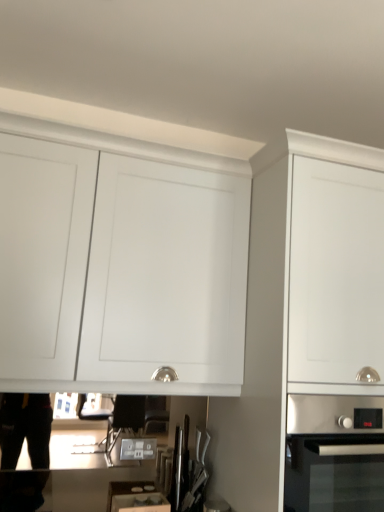
What do you see at coordinates (186, 471) in the screenshot? I see `stainless steel knife block at center` at bounding box center [186, 471].

Where is `stainless steel knife block at center`? stainless steel knife block at center is located at coordinates (186, 471).

From a real-world perspective, is white matte cabinet at center, placed as the 1th cabinetry when sorted from right to left, physically below stainless steel oven at lower right?

No.

Can you confirm if white matte cabinet at center, placed as the 1th cabinetry when sorted from right to left, is smaller than stainless steel oven at lower right?

Incorrect, white matte cabinet at center, placed as the 1th cabinetry when sorted from right to left, is not smaller in size than stainless steel oven at lower right.

Is the position of white matte cabinet at center, placed as the 2th cabinetry when sorted from left to right, more distant than that of stainless steel oven at lower right?

No, it is in front of stainless steel oven at lower right.

Who is more distant, stainless steel knife block at center or white matte cabinet at upper center, placed as the 1th cabinetry when sorted from left to right?

stainless steel knife block at center is more distant.

Is stainless steel knife block at center next to white matte cabinet at upper center, placed as the 1th cabinetry when sorted from left to right?

stainless steel knife block at center and white matte cabinet at upper center, placed as the 1th cabinetry when sorted from left to right, are not in contact.

From the image's perspective, which one is positioned higher, stainless steel knife block at center or white matte cabinet at upper center, the second cabinetry positioned from the right?

white matte cabinet at upper center, the second cabinetry positioned from the right, is shown above in the image.

Which point is more distant from viewer, [180,476] or [169,238]?

The point [180,476] is more distant.

Is matte white drawer at lower center inside stainless steel oven at lower right?

No, matte white drawer at lower center is located outside of stainless steel oven at lower right.

Is stainless steel oven at lower right facing away from matte white drawer at lower center?

No, stainless steel oven at lower right is not facing the opposite direction of matte white drawer at lower center.

Consider the image. Which is nearer, (369, 500) or (124, 490)?

Clearly, point (369, 500) is more distant from the camera than point (124, 490).

From the picture: Can you confirm if stainless steel oven at lower right is thinner than matte white drawer at lower center?

No, stainless steel oven at lower right is not thinner than matte white drawer at lower center.

From the image's perspective, between stainless steel oven at lower right and white matte cabinet at center, placed as the 2th cabinetry when sorted from left to right, who is located below?

stainless steel oven at lower right.

What's the angular difference between stainless steel oven at lower right and white matte cabinet at center, placed as the 2th cabinetry when sorted from left to right,'s facing directions?

0.000338 degrees separate the facing orientations of stainless steel oven at lower right and white matte cabinet at center, placed as the 2th cabinetry when sorted from left to right.

Is stainless steel oven at lower right smaller than white matte cabinet at center, placed as the 1th cabinetry when sorted from right to left?

Indeed, stainless steel oven at lower right has a smaller size compared to white matte cabinet at center, placed as the 1th cabinetry when sorted from right to left.

Could white matte cabinet at center, placed as the 1th cabinetry when sorted from right to left, be considered to be inside stainless steel oven at lower right?

No, white matte cabinet at center, placed as the 1th cabinetry when sorted from right to left, is not inside stainless steel oven at lower right.

From the picture: Is white matte cabinet at upper center, the second cabinetry positioned from the right, completely or partially inside matte white drawer at lower center?

No, white matte cabinet at upper center, the second cabinetry positioned from the right, is located outside of matte white drawer at lower center.

Are matte white drawer at lower center and white matte cabinet at upper center, placed as the 1th cabinetry when sorted from left to right, making contact?

No, matte white drawer at lower center is not making contact with white matte cabinet at upper center, placed as the 1th cabinetry when sorted from left to right.

From the image's perspective, which is above, matte white drawer at lower center or white matte cabinet at upper center, placed as the 1th cabinetry when sorted from left to right?

white matte cabinet at upper center, placed as the 1th cabinetry when sorted from left to right.

Between point (123, 508) and point (231, 343), which one is positioned in front?

Point (231, 343)

What's the angular difference between stainless steel knife block at center and stainless steel oven at lower right's facing directions?

3.21 degrees.

How far apart are stainless steel knife block at center and stainless steel oven at lower right?

The distance of stainless steel knife block at center from stainless steel oven at lower right is 59.99 centimeters.

From the image's perspective, which object appears higher, stainless steel knife block at center or stainless steel oven at lower right?

stainless steel oven at lower right.

Is point (176, 466) behind point (315, 500)?

Yes, point (176, 466) is behind point (315, 500).

How many degrees apart are the facing directions of white matte cabinet at upper center, placed as the 1th cabinetry when sorted from left to right, and stainless steel oven at lower right?

The angular difference between white matte cabinet at upper center, placed as the 1th cabinetry when sorted from left to right, and stainless steel oven at lower right is 0.00131 degrees.

Who is shorter, white matte cabinet at upper center, placed as the 1th cabinetry when sorted from left to right, or stainless steel oven at lower right?

stainless steel oven at lower right is shorter.

From the image's perspective, which one is positioned higher, white matte cabinet at upper center, the second cabinetry positioned from the right, or stainless steel oven at lower right?

white matte cabinet at upper center, the second cabinetry positioned from the right, appears higher in the image.

Does white matte cabinet at upper center, placed as the 1th cabinetry when sorted from left to right, turn towards stainless steel oven at lower right?

No, white matte cabinet at upper center, placed as the 1th cabinetry when sorted from left to right, is not oriented towards stainless steel oven at lower right.

Identify the location of home appliance located below the white matte cabinet at center, placed as the 1th cabinetry when sorted from right to left (from the image's perspective). (332, 455).

Locate an element on the screen. the 1st cabinetry in front of the stainless steel knife block at center is located at coordinates (119, 271).

Based on their spatial positions, is stainless steel knife block at center or white matte cabinet at upper center, the second cabinetry positioned from the right, closer to white matte cabinet at center, placed as the 2th cabinetry when sorted from left to right?

Among the two, white matte cabinet at upper center, the second cabinetry positioned from the right, is located nearer to white matte cabinet at center, placed as the 2th cabinetry when sorted from left to right.

From the image, which object appears to be farther from stainless steel knife block at center, white matte cabinet at center, placed as the 1th cabinetry when sorted from right to left, or stainless steel oven at lower right?

The object further to stainless steel knife block at center is stainless steel oven at lower right.

Which object lies nearer to the anchor point white matte cabinet at center, placed as the 2th cabinetry when sorted from left to right, stainless steel knife block at center or matte white drawer at lower center?

stainless steel knife block at center lies closer to white matte cabinet at center, placed as the 2th cabinetry when sorted from left to right, than the other object.

Estimate the real-world distances between objects in this image. Which object is further from matte white drawer at lower center, stainless steel oven at lower right or white matte cabinet at center, placed as the 2th cabinetry when sorted from left to right?

Based on the image, stainless steel oven at lower right appears to be further to matte white drawer at lower center.

Which object lies further to the anchor point white matte cabinet at center, placed as the 1th cabinetry when sorted from right to left, matte white drawer at lower center or stainless steel oven at lower right?

matte white drawer at lower center is further to white matte cabinet at center, placed as the 1th cabinetry when sorted from right to left.

From the image, which object appears to be nearer to matte white drawer at lower center, stainless steel knife block at center or stainless steel oven at lower right?

stainless steel knife block at center is closer to matte white drawer at lower center.

When comparing their distances from white matte cabinet at center, placed as the 1th cabinetry when sorted from right to left, does stainless steel oven at lower right or white matte cabinet at upper center, the second cabinetry positioned from the right, seem closer?

The object closer to white matte cabinet at center, placed as the 1th cabinetry when sorted from right to left, is stainless steel oven at lower right.

Considering their positions, is white matte cabinet at upper center, placed as the 1th cabinetry when sorted from left to right, positioned closer to matte white drawer at lower center than stainless steel knife block at center?

Among the two, stainless steel knife block at center is located nearer to matte white drawer at lower center.

Locate an element on the screen. home appliance between stainless steel knife block at center and white matte cabinet at center, placed as the 1th cabinetry when sorted from right to left is located at coordinates (332, 455).

The width and height of the screenshot is (384, 512). Find the location of `kitchen appliance between matte white drawer at lower center and white matte cabinet at center, placed as the 2th cabinetry when sorted from left to right`. kitchen appliance between matte white drawer at lower center and white matte cabinet at center, placed as the 2th cabinetry when sorted from left to right is located at coordinates (186, 471).

You are a GUI agent. You are given a task and a screenshot of the screen. Output one action in this format:
    pyautogui.click(x=<x>, y=<y>)
    Task: Click on the home appliance that lies between white matte cabinet at upper center, the second cabinetry positioned from the right, and matte white drawer at lower center from top to bottom
    
    Given the screenshot: What is the action you would take?
    [x=332, y=455]

This screenshot has height=512, width=384. In order to click on home appliance that lies between white matte cabinet at upper center, the second cabinetry positioned from the right, and stainless steel knife block at center from top to bottom in this screenshot , I will do `click(332, 455)`.